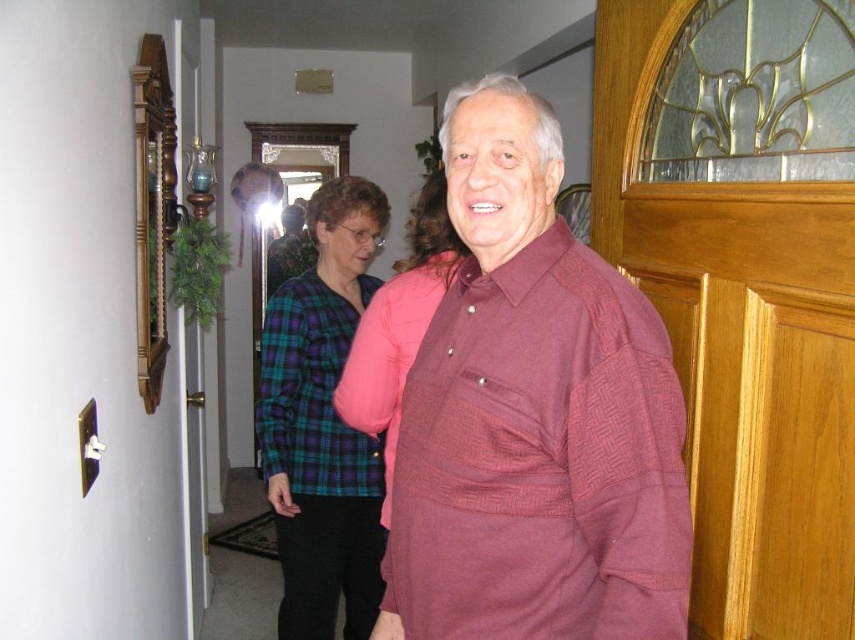
Measure the distance between plaid fabric shirt at center and green plaid shirt at center.

plaid fabric shirt at center is 2.96 inches from green plaid shirt at center.

Can you confirm if plaid fabric shirt at center is shorter than green plaid shirt at center?

No, plaid fabric shirt at center is not shorter than green plaid shirt at center.

Who is more forward, (282, 547) or (296, 353)?

Point (296, 353) is more forward.

Identify the location of plaid fabric shirt at center. Image resolution: width=855 pixels, height=640 pixels. (323, 422).

Which of these two, maroon woven shirt at center or green plaid shirt at center, stands shorter?

green plaid shirt at center

Is point (517, 342) closer to camera compared to point (266, 362)?

Yes, it is.

In order to click on maroon woven shirt at center in this screenshot , I will do `click(534, 417)`.

Consider the image. Is maroon woven shirt at center thinner than plaid fabric shirt at center?

No, maroon woven shirt at center is not thinner than plaid fabric shirt at center.

Is maroon woven shirt at center smaller than plaid fabric shirt at center?

Yes, maroon woven shirt at center is smaller than plaid fabric shirt at center.

Does point (547, 636) lie behind point (388, 211)?

That is False.

What are the coordinates of `maroon woven shirt at center` in the screenshot? It's located at (534, 417).